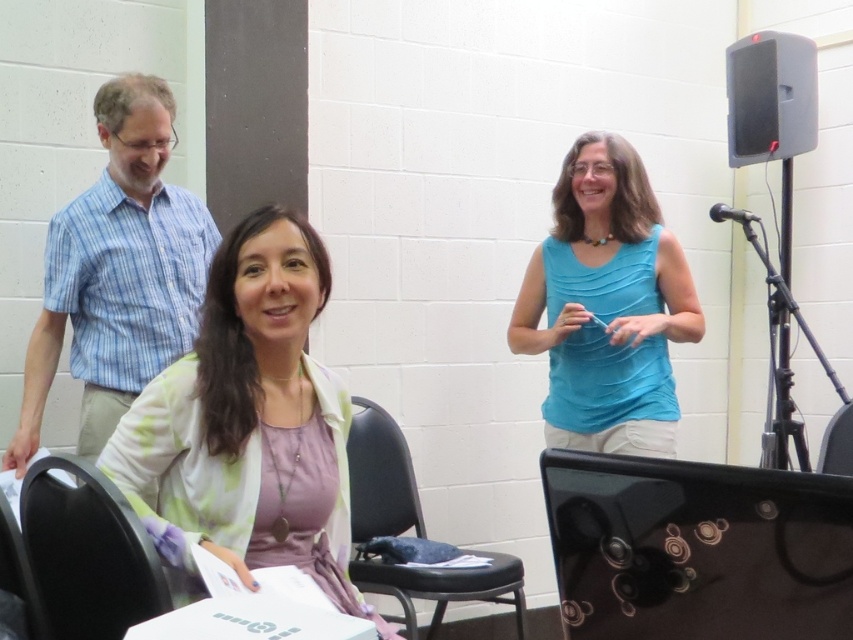
Question: Which point appears closest to the camera in this image?

Choices:
 (A) (572, 481)
 (B) (578, 282)
 (C) (207, 413)

Answer: (A)

Question: Can you confirm if pastel floral cardigan at center is thinner than black plastic chair at lower left?

Choices:
 (A) no
 (B) yes

Answer: (A)

Question: Which object is positioned closest to the black plastic chair at lower left?

Choices:
 (A) black fabric chair at lower center
 (B) black plastic chair at lower right

Answer: (A)

Question: Among these points, which one is nearest to the camera?

Choices:
 (A) (380, 572)
 (B) (628, 212)
 (C) (734, 481)

Answer: (C)

Question: Does black plastic chair at lower left appear on the left side of black plastic chair at lower right?

Choices:
 (A) yes
 (B) no

Answer: (A)

Question: Can you confirm if pastel floral cardigan at center is positioned above black fabric chair at lower center?

Choices:
 (A) yes
 (B) no

Answer: (A)